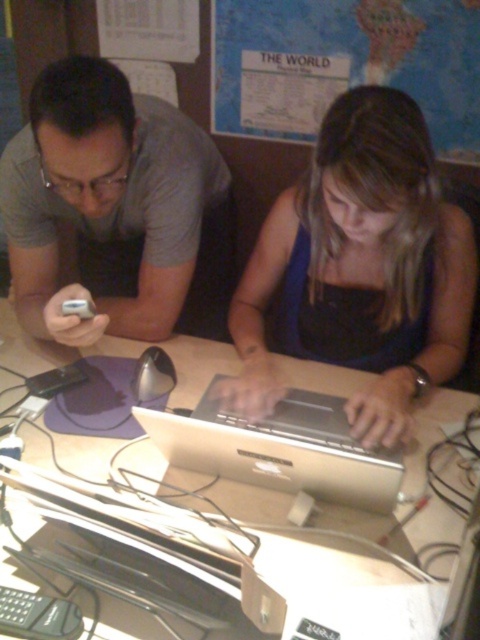
Question: Among these points, which one is nearest to the camera?

Choices:
 (A) (242, 500)
 (B) (277, 60)

Answer: (A)

Question: Can you confirm if white glossy table at center is positioned to the right of silver metallic laptop at center?

Choices:
 (A) yes
 (B) no

Answer: (B)

Question: Considering the relative positions of mappaperbulletin board at upper center and white glossy table at center in the image provided, where is mappaperbulletin board at upper center located with respect to white glossy table at center?

Choices:
 (A) below
 (B) above

Answer: (B)

Question: Estimate the real-world distances between objects in this image. Which object is farther from the blue fabric dress at center?

Choices:
 (A) mappaperbulletin board at upper center
 (B) white glossy table at center
 (C) matte gray shirt at left
 (D) silver metallic laptop at center

Answer: (A)

Question: Among these objects, which one is nearest to the camera?

Choices:
 (A) blue fabric dress at center
 (B) matte gray shirt at left

Answer: (A)

Question: Observing the image, what is the correct spatial positioning of matte gray shirt at left in reference to white glossy table at center?

Choices:
 (A) below
 (B) above

Answer: (B)